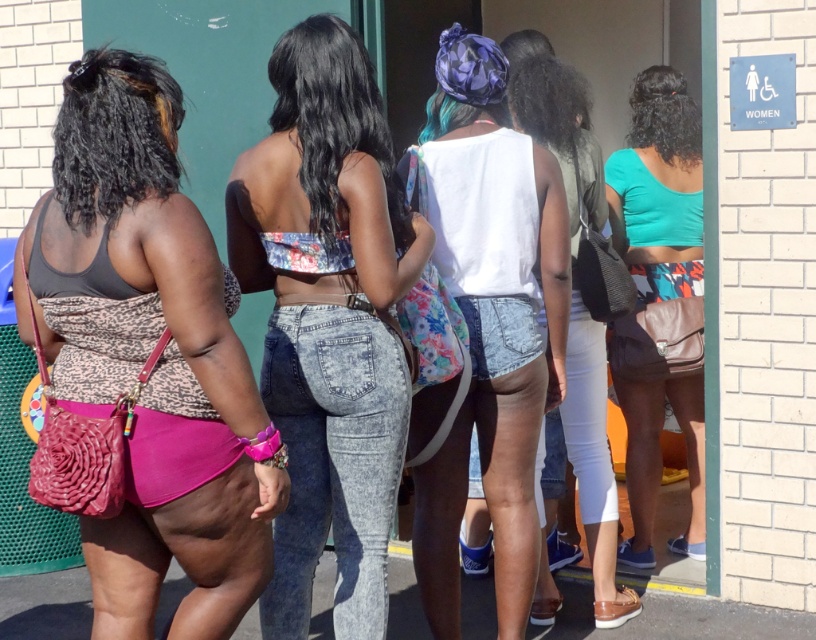
You are a photographer trying to capture a shot of the white matte tank top at center. Based on its position coordinates, can you determine if it is centrally located in the image?

The white matte tank top at center is located at point coordinates (490, 323), which is very close to the center of the image, so yes, it can be considered centrally located.

You are a delivery person who needs to leave a package at the exact location of the leopard print purse at left. The coordinate system starts at the bottom left corner of the image. What are the coordinates where you should place the package?

The leopard print purse at left is located at coordinates point (149, 356), so you should place the package there.